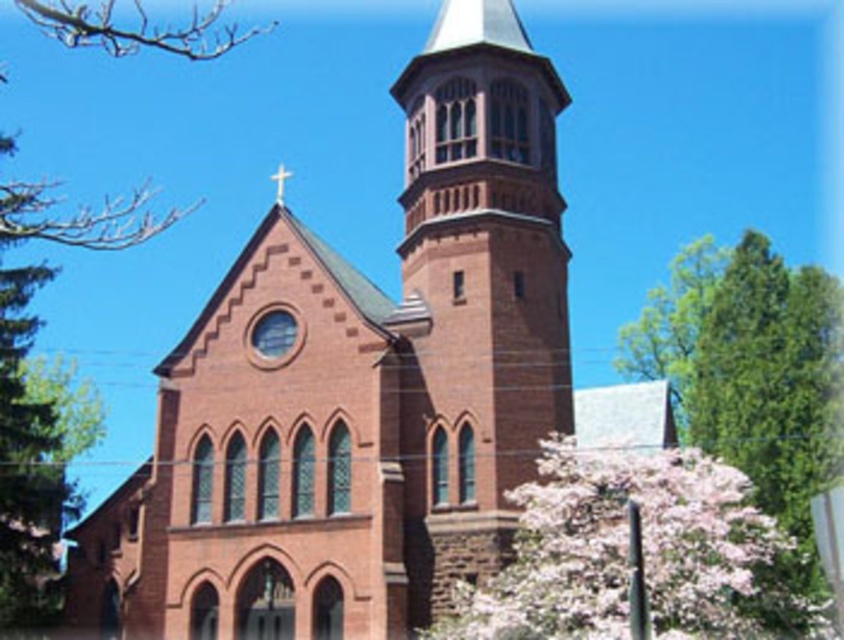
You are a photographer planning to capture the entire red brick church at center and the pink blossoms at lower right in a single frame. Based on their sizes, which object should you focus on to ensure both are visible without cropping?

The red brick church at center is wider than the pink blossoms at lower right, so you should focus on the red brick church at center to ensure both are visible in the frame.

You are standing in front of the Gothic church and notice the green leafy tree at upper left and the smooth wooden cross at upper center. Which object appears closer to you from your viewing position?

The green leafy tree at upper left appears closer to you because it is in front of the smooth wooden cross at upper center.

You are standing at the point marked by coordinates point (366, 388). Which object are you facing? Please answer with the object label exactly as given in the Objects section.

The point (366, 388) marks the red brick church at center, so you are facing the red brick church at center.